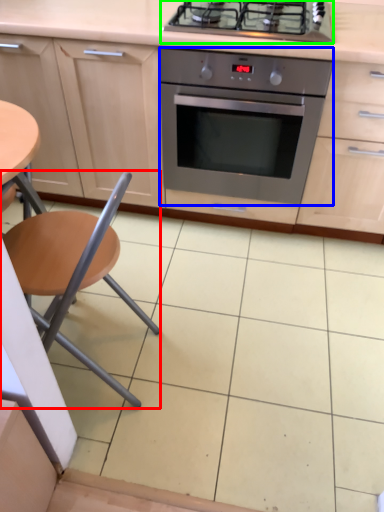
Question: Which object is positioned closest to chair (highlighted by a red box)? Select from kitchen appliance (highlighted by a blue box) and gas stove (highlighted by a green box).

Choices:
 (A) kitchen appliance
 (B) gas stove

Answer: (A)